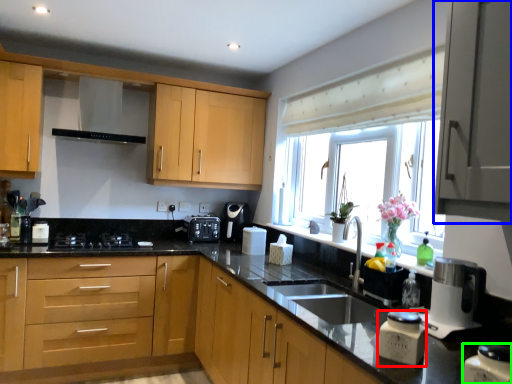
Question: Which is farther away from kitchen appliance (highlighted by a red box)? cabinetry (highlighted by a blue box) or kitchen appliance (highlighted by a green box)?

Choices:
 (A) cabinetry
 (B) kitchen appliance

Answer: (A)